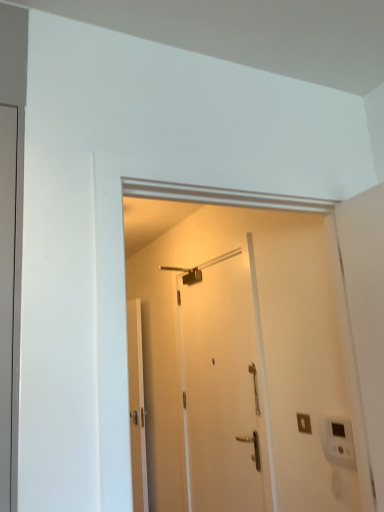
Question: Is white matte door at center, the third door viewed from the left, with white glossy door at center, which ranks as the 2th door in right-to-left order?

Choices:
 (A) no
 (B) yes

Answer: (A)

Question: Is white matte door at center, which is the 2th door from back to front, positioned with its back to white glossy door at center, arranged as the 3th door when viewed from the front?

Choices:
 (A) no
 (B) yes

Answer: (A)

Question: Is white matte door at center, the third door viewed from the left, positioned far away from white glossy door at center, arranged as the second door when viewed from the left?

Choices:
 (A) no
 (B) yes

Answer: (B)

Question: Is white matte door at center, which is the 2th door from back to front, not within white glossy door at center, the first door positioned from the back?

Choices:
 (A) no
 (B) yes

Answer: (B)

Question: Is white matte door at center, which is the 2th door from back to front, positioned behind white glossy door at center, arranged as the 3th door when viewed from the front?

Choices:
 (A) no
 (B) yes

Answer: (A)

Question: From the image's perspective, is white matte door at center, which appears as the first door when viewed from the right, located above or below matte gray door at left, the third door viewed from the right?

Choices:
 (A) above
 (B) below

Answer: (B)

Question: In terms of height, does white matte door at center, which appears as the first door when viewed from the right, look taller or shorter compared to matte gray door at left, the third door viewed from the right?

Choices:
 (A) tall
 (B) short

Answer: (A)

Question: Considering the positions of white matte door at center, which is the 2th door from back to front, and matte gray door at left, arranged as the 1th door when viewed from the left, in the image, is white matte door at center, which is the 2th door from back to front, wider or thinner than matte gray door at left, arranged as the 1th door when viewed from the left,?

Choices:
 (A) thin
 (B) wide

Answer: (A)

Question: Is point (244, 311) positioned closer to the camera than point (8, 271)?

Choices:
 (A) closer
 (B) farther

Answer: (B)

Question: Considering the positions of matte gray door at left, arranged as the 1th door when viewed from the left, and metallic silver shower at upper center in the image, is matte gray door at left, arranged as the 1th door when viewed from the left, bigger or smaller than metallic silver shower at upper center?

Choices:
 (A) big
 (B) small

Answer: (A)

Question: Is point tap(3, 118) closer or farther from the camera than point tap(192, 280)?

Choices:
 (A) farther
 (B) closer

Answer: (B)

Question: From a real-world perspective, is matte gray door at left, arranged as the 1th door when viewed from the left, positioned above or below metallic silver shower at upper center?

Choices:
 (A) above
 (B) below

Answer: (B)

Question: Is matte gray door at left, the first door viewed from the front, inside the boundaries of metallic silver shower at upper center, or outside?

Choices:
 (A) inside
 (B) outside

Answer: (B)

Question: Is matte gray door at left, the third door viewed from the right, inside the boundaries of white matte door at center, the third door viewed from the left, or outside?

Choices:
 (A) inside
 (B) outside

Answer: (B)

Question: Is matte gray door at left, the first door viewed from the front, to the left or to the right of white matte door at center, which appears as the first door when viewed from the right, in the image?

Choices:
 (A) left
 (B) right

Answer: (A)